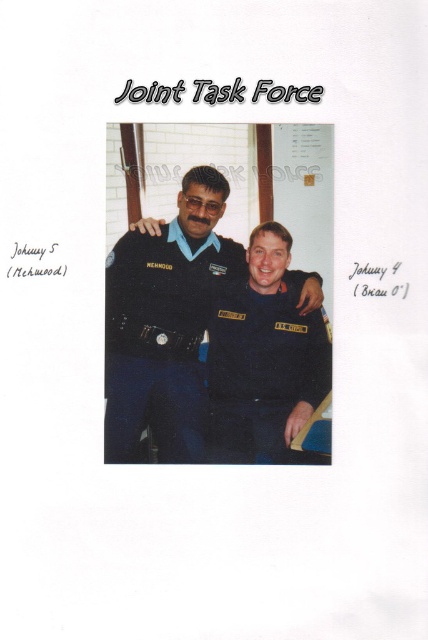
You are a tailor who needs to determine which uniform requires more fabric for alterations. Based on the image, which uniform would need more fabric, the matte black uniform at center or the dark blue fabric uniform at center?

The matte black uniform at center is larger in size than the dark blue fabric uniform at center, so it would require more fabric for alterations.

You are standing in the room where the photograph was taken and want to place a small decorative item exactly where the matte black uniform at center is located. What coordinates should you use to position it?

The coordinates for the matte black uniform at center are at point (166, 323), so you should place the decorative item at those coordinates.

You are standing in front of the photograph and want to determine which point is closer to you. The points are labeled as point 1 at coordinates (190,365) and point 2 at coordinates (303,337). Which point is closer to you?

Point 1 at coordinates (190,365) is closer to you because it is further to the viewer than point 2 at coordinates (303,337).